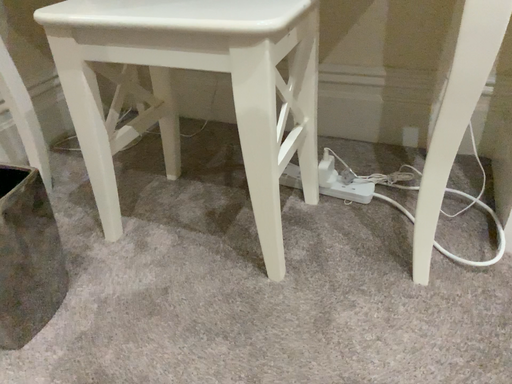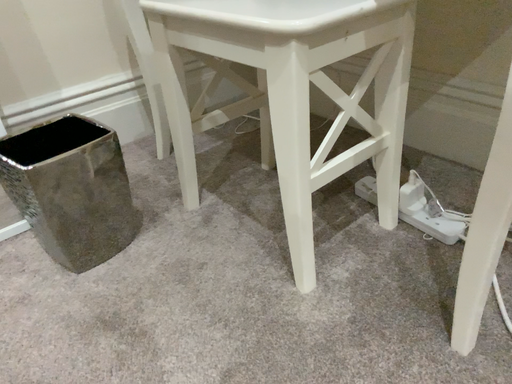
Question: Which way did the camera rotate in the video?

Choices:
 (A) rotated right
 (B) rotated left

Answer: (B)